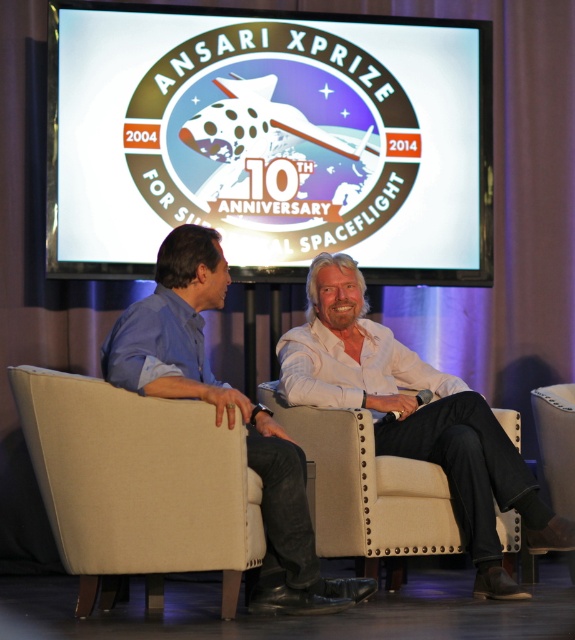
Question: Does beige fabric armchair at lower left have a smaller size compared to white leather chair at center?

Choices:
 (A) no
 (B) yes

Answer: (B)

Question: Based on their relative distances, which object is farther from the white glossy screen at upper center?

Choices:
 (A) white cotton shirt at center
 (B) beige fabric armchair at lower right
 (C) white leather chair at center

Answer: (C)

Question: Which point is farther from the camera taking this photo?

Choices:
 (A) (573, 406)
 (B) (277, 508)
 (C) (363, 244)

Answer: (C)

Question: Considering the relative positions of white cotton shirt at center and beige fabric armchair at lower right in the image provided, where is white cotton shirt at center located with respect to beige fabric armchair at lower right?

Choices:
 (A) left
 (B) right

Answer: (A)

Question: Which is farther from the white glossy screen at upper center?

Choices:
 (A) beige fabric armchair at lower right
 (B) white cotton shirt at center
 (C) beige fabric armchair at lower left

Answer: (C)

Question: Can you confirm if beige fabric armchair at lower left is wider than white cotton shirt at center?

Choices:
 (A) yes
 (B) no

Answer: (B)